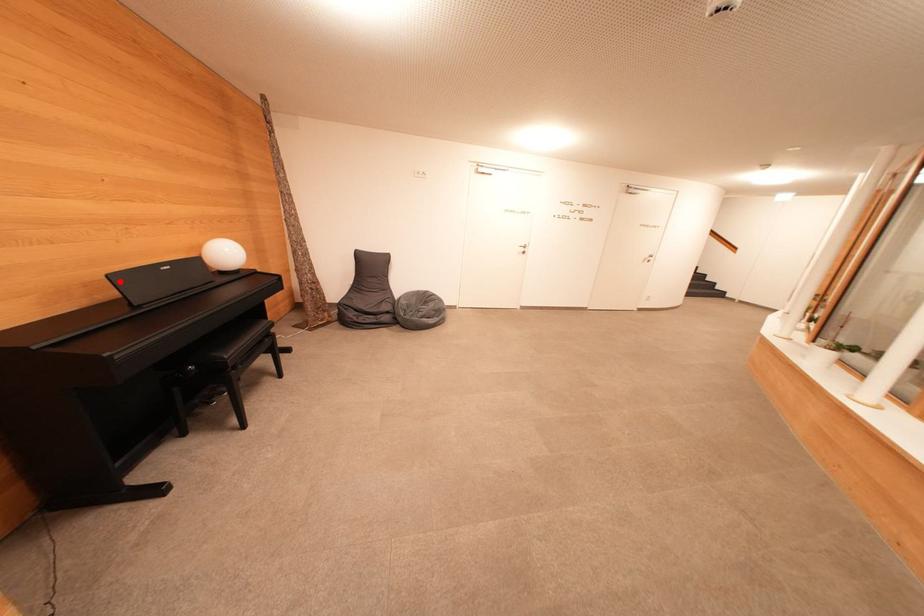
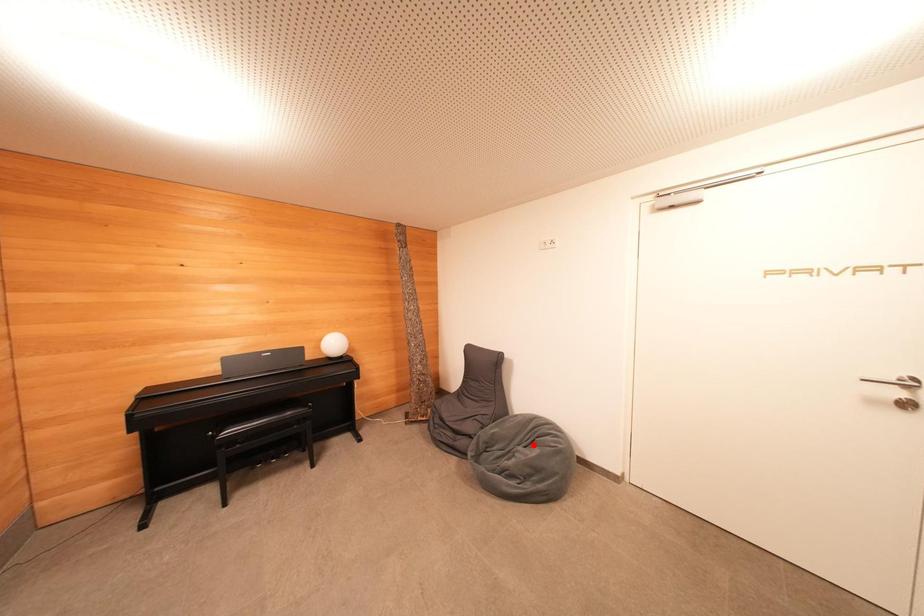
I am providing you with two images of the same scene from different viewpoints. A red point is marked on the first image and another point is marked on the second image. Do the highlighted points in image1 and image2 indicate the same real-world spot?

No